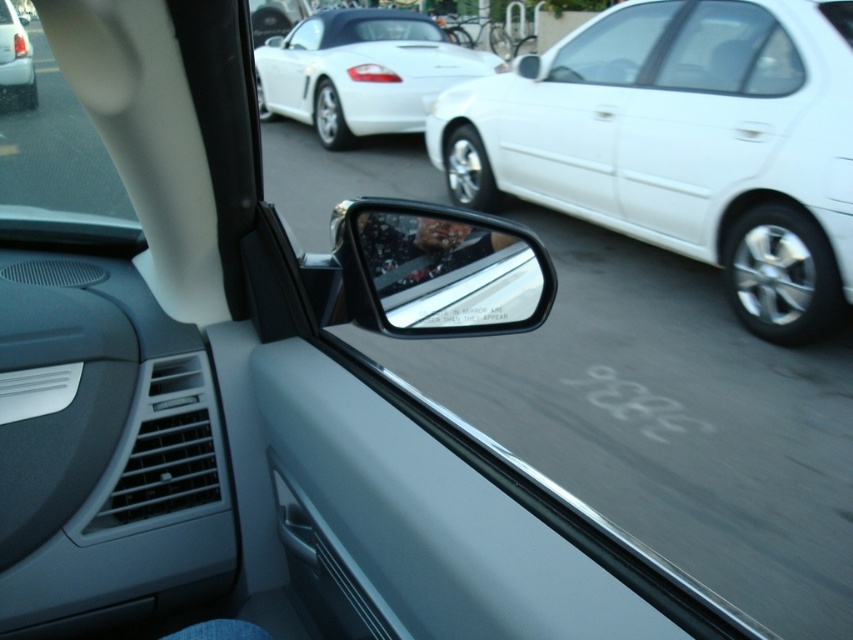
Question: Can you confirm if clear glass car window at upper right is wider than matte black car at upper left?

Choices:
 (A) no
 (B) yes

Answer: (A)

Question: Is white glossy sedan at right positioned behind transparent plastic car window at upper left?

Choices:
 (A) no
 (B) yes

Answer: (B)

Question: Which point is farther to the camera?

Choices:
 (A) (399, 120)
 (B) (59, 93)

Answer: (B)

Question: Is white glossy sedan at right above matte black car at upper left?

Choices:
 (A) yes
 (B) no

Answer: (B)

Question: Estimate the real-world distances between objects in this image. Which object is closer to the white glossy convertible at upper center?

Choices:
 (A) clear glass car window at upper right
 (B) transparent plastic car window at upper left
 (C) clear glass mirror at center

Answer: (B)

Question: Which point appears farthest from the camera in this image?

Choices:
 (A) (18, 140)
 (B) (409, 260)
 (C) (659, 83)

Answer: (A)